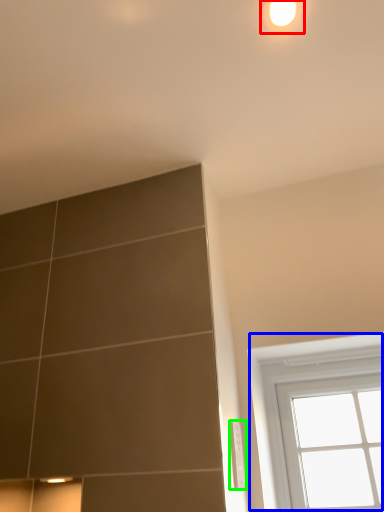
Question: Based on their relative distances, which object is farther from light (highlighted by a red box)? Choose from window (highlighted by a blue box) and electric outlet (highlighted by a green box).

Choices:
 (A) window
 (B) electric outlet

Answer: (A)